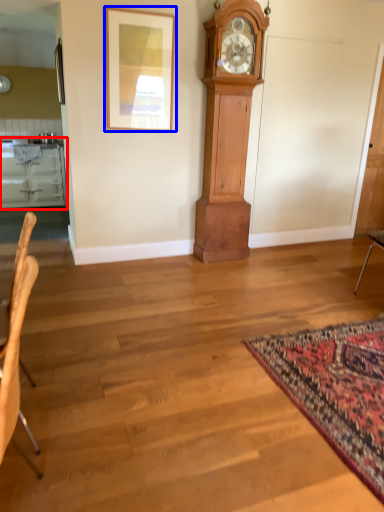
Question: Which object appears farthest to the camera in this image, cabinetry (highlighted by a red box) or picture frame (highlighted by a blue box)?

Choices:
 (A) cabinetry
 (B) picture frame

Answer: (A)